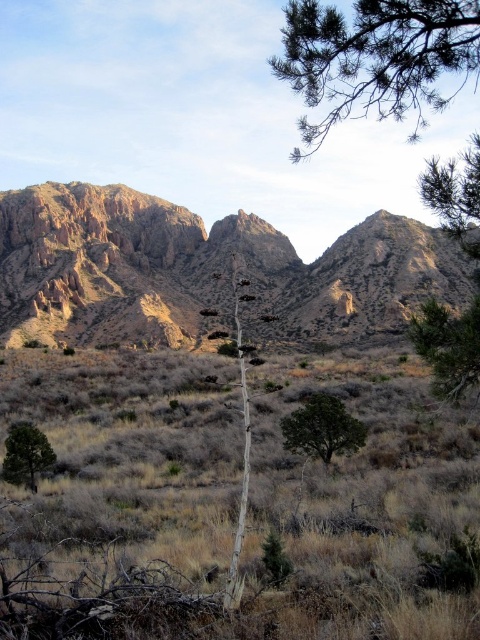
Question: Can you confirm if rustic rock mountain range at upper left is thinner than green leafy tree at lower left?

Choices:
 (A) yes
 (B) no

Answer: (B)

Question: Is white bark tree at center further to the viewer compared to green leafy tree at lower left?

Choices:
 (A) yes
 (B) no

Answer: (B)

Question: Estimate the real-world distances between objects in this image. Which object is farther from the rustic rock mountain range at upper left?

Choices:
 (A) green leafy tree at lower left
 (B) dry grass at center
 (C) green textured pine tree at right

Answer: (A)

Question: Observing the image, what is the correct spatial positioning of dry grass at center in reference to rustic rock mountain range at upper left?

Choices:
 (A) above
 (B) below

Answer: (B)

Question: Considering the real-world distances, which object is closest to the green textured pine tree at right?

Choices:
 (A) dry grass at center
 (B) white bark tree at center

Answer: (A)

Question: Which object is the closest to the green needle-like branches at upper right?

Choices:
 (A) dry grass at center
 (B) green leafy tree at center
 (C) rustic rock mountain range at upper left

Answer: (B)